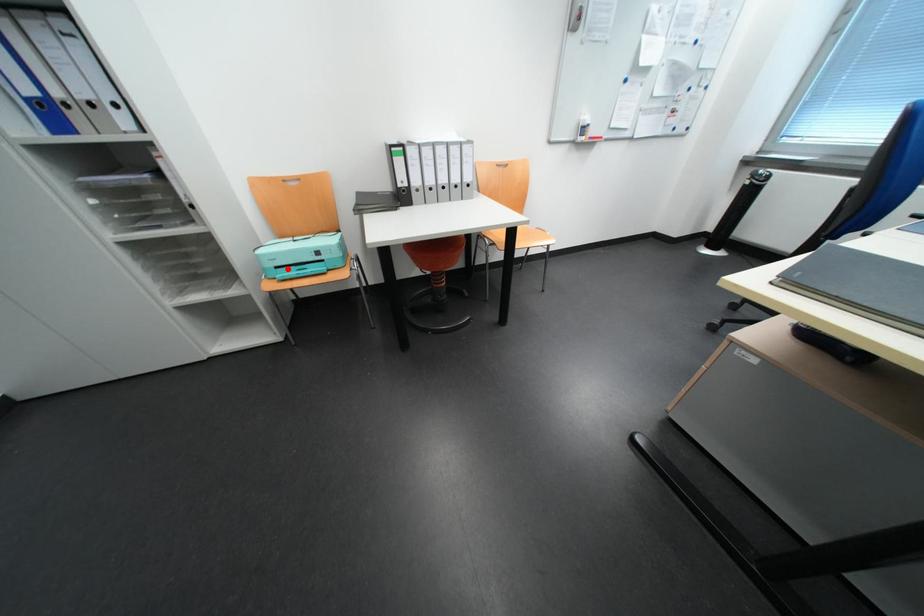
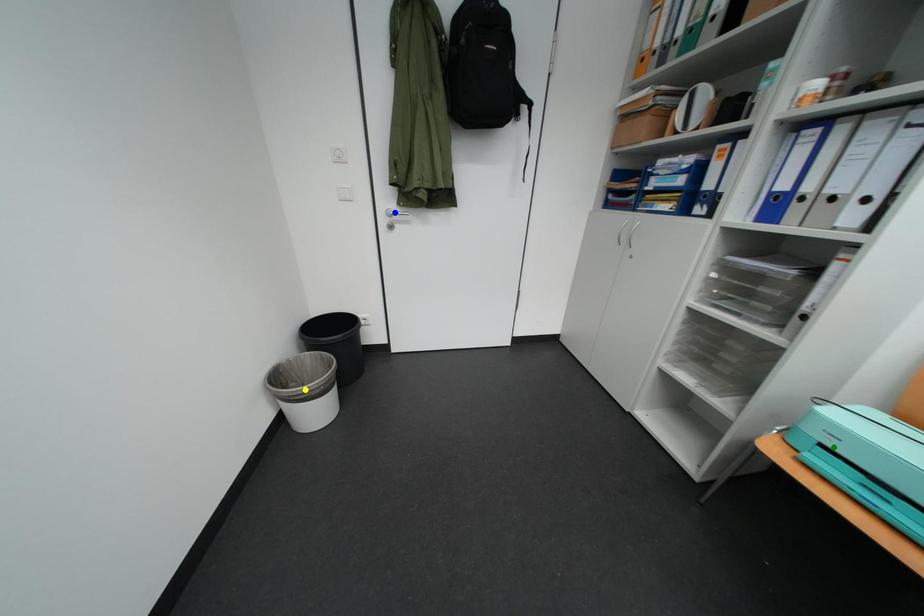
Question: I am providing you with two images of the same scene from different viewpoints. A red point is marked on the first image. You are given multiple points on the second image. In image 2, which mark is for the same physical point as the one in image 1?

Choices:
 (A) blue point
 (B) yellow point
 (C) green point

Answer: (C)